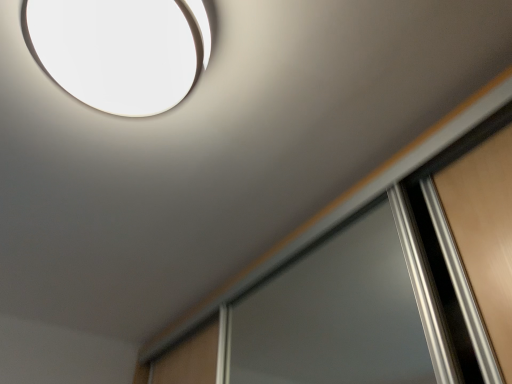
Describe the element at coordinates (121, 50) in the screenshot. I see `white glossy lampshade at upper left` at that location.

What are the coordinates of `white glossy lampshade at upper left` in the screenshot? It's located at (121, 50).

Where is `white glossy lampshade at upper left`? The height and width of the screenshot is (384, 512). white glossy lampshade at upper left is located at coordinates (x=121, y=50).